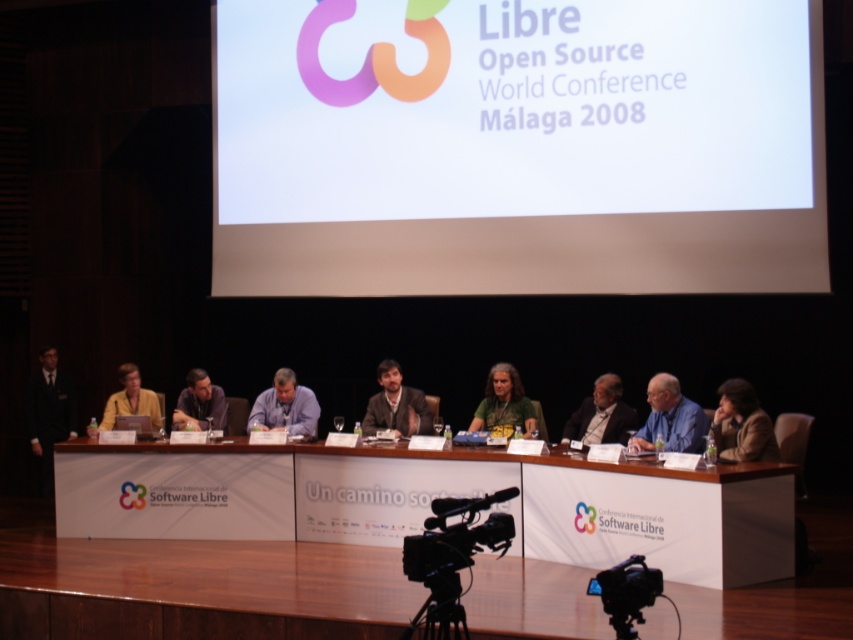
Question: In this image, where is gray fabric shirt at center located relative to black plastic tripod at lower center?

Choices:
 (A) above
 (B) below

Answer: (A)

Question: Is brown leather jacket at lower right behind matte black projector at center?

Choices:
 (A) yes
 (B) no

Answer: (B)

Question: Which object appears farthest from the camera in this image?

Choices:
 (A) black plastic video camera at lower right
 (B) blue shirt at center
 (C) matte black projector at center
 (D) brown leather jacket at lower right

Answer: (C)

Question: Among these points, which one is farthest from the camera?

Choices:
 (A) (506, 400)
 (B) (459, 444)

Answer: (A)

Question: Can you confirm if matte blue shirt at center is positioned to the left of matte purple shirt at center?

Choices:
 (A) no
 (B) yes

Answer: (A)

Question: Which point appears closest to the camera in this image?

Choices:
 (A) (461, 442)
 (B) (608, 420)

Answer: (B)